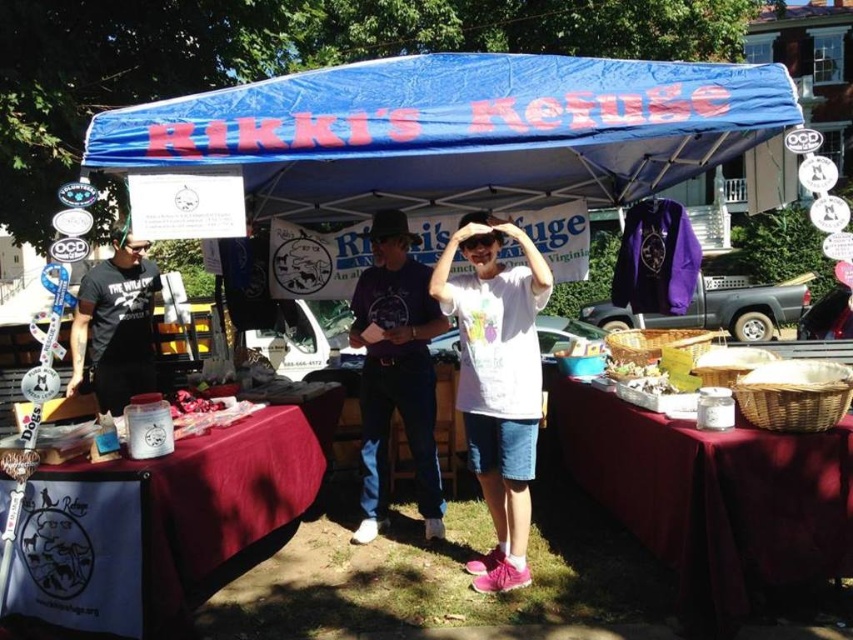
You are a visitor at the event and want to find the main information desk. The main information desk is located under the blue fabric canopy at upper center. However, you are currently standing near the white fabric table at lower left. To reach the canopy, should you move to your right or left?

The blue fabric canopy at upper center is to the right of the white fabric table at lower left. So you should move to your right to reach the canopy.

You are setting up a booth for a charity event and need to hang a banner under the blue fabric canopy at upper center. The banner must not block the view of the white fabric table at lower left. Based on their positions, can you hang the banner without obscuring the table?

The blue fabric canopy at upper center is above the white fabric table at lower left, so hanging the banner under the canopy would still allow the table to be visible from below since the canopy is positioned higher up.

You are standing at the point labeled point (456, 131) in the image. What object are you directly under?

The point labeled point (456, 131) is directly under the blue fabric canopy at upper center.